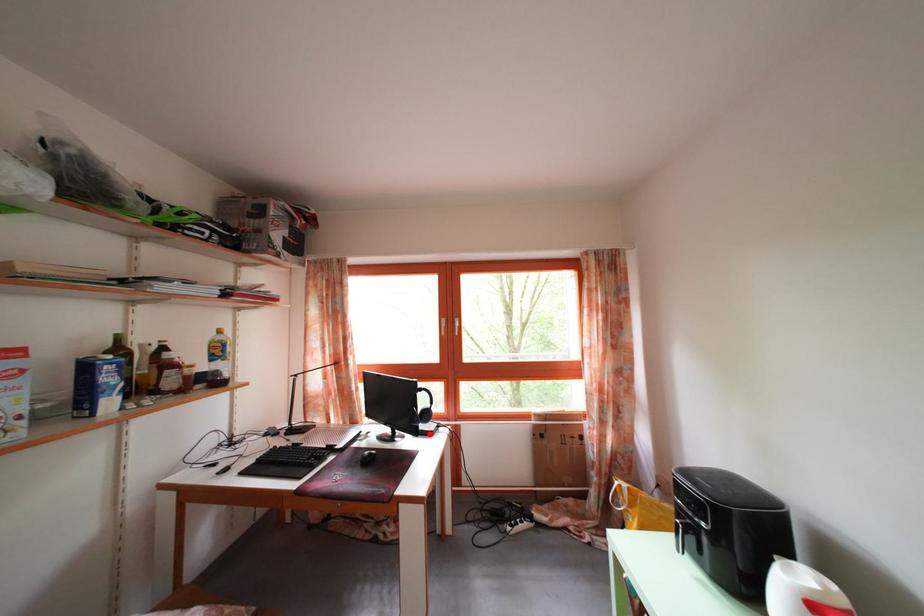
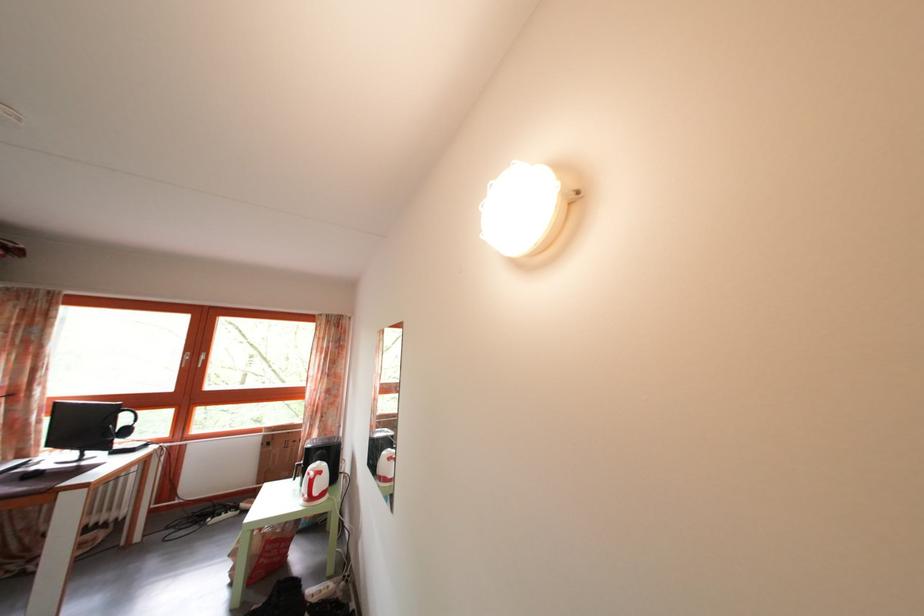
The point at the highlighted location is marked in the first image. Where is the corresponding point in the second image?

(128, 451)